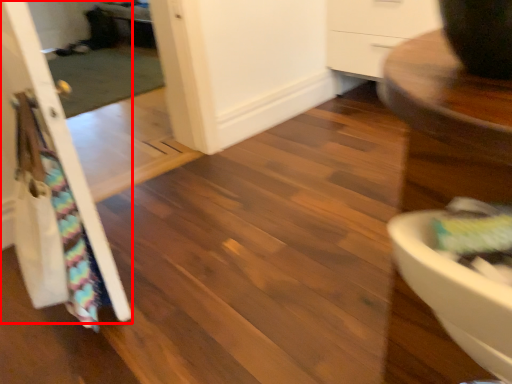
Question: From the image's perspective, what is the correct spatial positioning of door (annotated by the red box) in reference to screen door?

Choices:
 (A) above
 (B) below

Answer: (B)